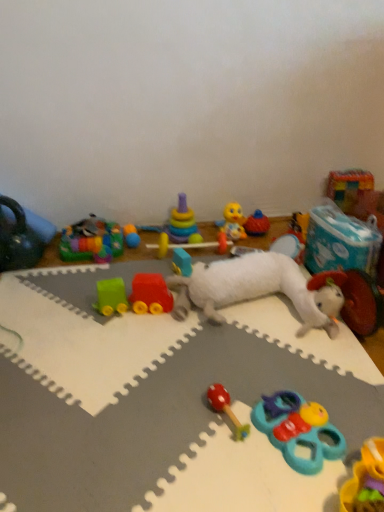
Find the location of a particular element. Image resolution: width=384 pixels, height=512 pixels. free space in front of matte black kettlebell at left, placed as the 15th toy when sorted from right to left is located at coordinates (26, 283).